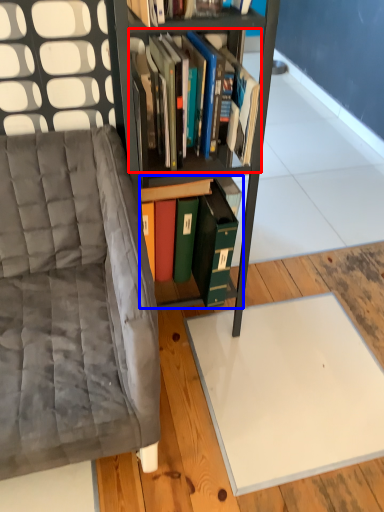
Question: Which of the following is the closest to the observer, book (highlighted by a red box) or book (highlighted by a blue box)?

Choices:
 (A) book
 (B) book

Answer: (A)